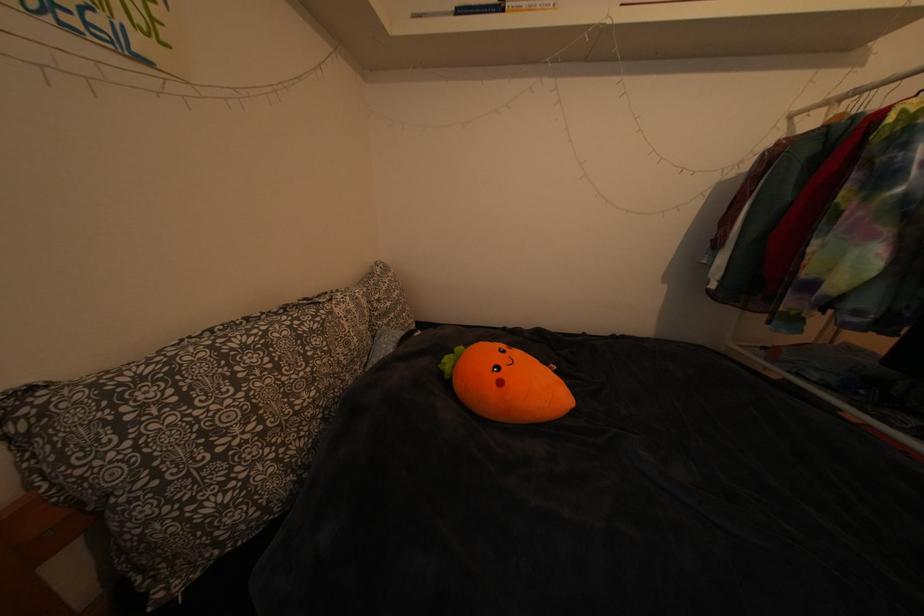
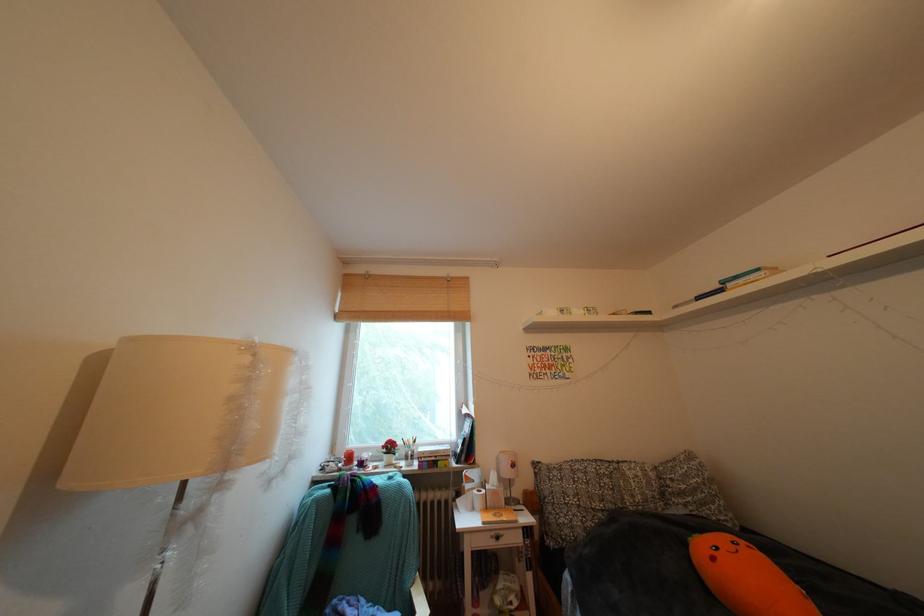
Where in the second image is the point corresponding to the point at 388,306 from the first image?

(682, 485)